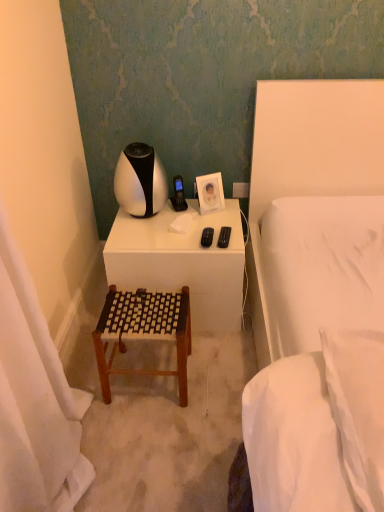
Describe the element at coordinates (182, 262) in the screenshot. I see `white matte desk at center` at that location.

Measure the distance between white fabric bed at right and camera.

The depth of white fabric bed at right is 6.02 feet.

Measure the distance between point (x=138, y=201) and camera.

Point (x=138, y=201) is 1.92 meters away from camera.

This screenshot has width=384, height=512. In order to click on white glossy table lamp at upper center in this screenshot , I will do `click(140, 181)`.

Measure the distance between white soft pillow at right and camera.

white soft pillow at right and camera are 30.63 inches apart.

The width and height of the screenshot is (384, 512). What are the coordinates of `white fabric curtain at left` in the screenshot? It's located at (35, 401).

Does brown woven stool at center appear on the left side of white matte desk at center?

Indeed, brown woven stool at center is positioned on the left side of white matte desk at center.

Does brown woven stool at center contain white matte desk at center?

Definitely not — white matte desk at center is not inside brown woven stool at center.

Considering the sizes of objects brown woven stool at center and white matte desk at center in the image provided, who is smaller, brown woven stool at center or white matte desk at center?

brown woven stool at center.

In order to click on desk that is behind the brown woven stool at center in this screenshot , I will do `click(182, 262)`.

Is white glossy table lamp at upper center aimed at white fabric curtain at left?

No, white glossy table lamp at upper center is not aimed at white fabric curtain at left.

From the image's perspective, is white glossy table lamp at upper center located above or below white fabric curtain at left?

white glossy table lamp at upper center is situated higher than white fabric curtain at left in the image.

From a real-world perspective, is white glossy table lamp at upper center physically located above or below white fabric curtain at left?

white glossy table lamp at upper center is above white fabric curtain at left.

Is white glossy table lamp at upper center completely or partially outside of white matte desk at center?

Yes, white glossy table lamp at upper center is located beyond the bounds of white matte desk at center.

Which is more distant, (155, 196) or (119, 273)?

Positioned behind is point (155, 196).

From a real-world perspective, who is located lower, white glossy table lamp at upper center or white matte desk at center?

From a 3D spatial view, white matte desk at center is below.

From the image's perspective, between white matte desk at center and brown woven stool at center, who is located below?

brown woven stool at center is shown below in the image.

Considering the relative positions of white matte desk at center and brown woven stool at center in the image provided, is white matte desk at center to the right of brown woven stool at center from the viewer's perspective?

Correct, you'll find white matte desk at center to the right of brown woven stool at center.

In terms of width, does white matte desk at center look wider or thinner when compared to brown woven stool at center?

Considering their sizes, white matte desk at center looks broader than brown woven stool at center.

Is point (222, 267) positioned behind point (170, 334)?

Yes, point (222, 267) is behind point (170, 334).

What's the angular difference between white fabric curtain at left and white soft pillow at right's facing directions?

The angular difference between white fabric curtain at left and white soft pillow at right is 1.12 degrees.

From a real-world perspective, which is physically below, white fabric curtain at left or white soft pillow at right?

white fabric curtain at left, from a real-world perspective.

From the image's perspective, between white fabric curtain at left and white soft pillow at right, who is located below?

Answer: From the image's view, white fabric curtain at left is below.

At what (x,y) coordinates should I click in order to perform the action: click on desk behind the white fabric bed at right. Please return your answer as a coordinate pair (x, y). This screenshot has height=512, width=384. Looking at the image, I should click on (182, 262).

Which of these two, white matte desk at center or white fabric bed at right, is bigger?

white fabric bed at right.

Is white matte desk at center closer to the viewer compared to white fabric bed at right?

No, it is behind white fabric bed at right.

Which object is thinner, white matte desk at center or white fabric bed at right?

Thinner between the two is white matte desk at center.

Would you say white fabric curtain at left is a long distance from white matte desk at center?

No.

Between white fabric curtain at left and white matte desk at center, which one is positioned behind?

white matte desk at center is more distant.

From a real-world perspective, does white fabric curtain at left stand above white matte desk at center?

No, from a real-world perspective, white fabric curtain at left is not on top of white matte desk at center.

Which of these two, white fabric curtain at left or white matte desk at center, is thinner?

Thinner between the two is white fabric curtain at left.

Identify the location of furniture on the left of white matte desk at center. The image size is (384, 512). (143, 331).

Identify the location of curtain that appears below the white glossy table lamp at upper center (from a real-world perspective). This screenshot has height=512, width=384. (35, 401).

Estimate the real-world distances between objects in this image. Which object is further from white glossy table lamp at upper center, white fabric bed at right or brown woven stool at center?

white fabric bed at right.

Which object lies nearer to the anchor point white fabric curtain at left, brown woven stool at center or white matte desk at center?

brown woven stool at center is closer to white fabric curtain at left.

Based on their spatial positions, is white soft pillow at right or white fabric curtain at left further from brown woven stool at center?

white soft pillow at right lies further to brown woven stool at center than the other object.

Based on their spatial positions, is white glossy table lamp at upper center or white fabric bed at right closer to white soft pillow at right?

Based on the image, white fabric bed at right appears to be nearer to white soft pillow at right.

Estimate the real-world distances between objects in this image. Which object is closer to brown woven stool at center, white soft pillow at right or white fabric bed at right?

The object closer to brown woven stool at center is white fabric bed at right.

Looking at the image, which one is located closer to brown woven stool at center, white fabric bed at right or white matte desk at center?

Among the two, white matte desk at center is located nearer to brown woven stool at center.

When comparing their distances from brown woven stool at center, does white glossy table lamp at upper center or white soft pillow at right seem further?

white soft pillow at right is further to brown woven stool at center.

From the image, which object appears to be farther from white fabric curtain at left, white soft pillow at right or white glossy table lamp at upper center?

white glossy table lamp at upper center is positioned further to the anchor white fabric curtain at left.

The width and height of the screenshot is (384, 512). Identify the location of furniture between white soft pillow at right and white glossy table lamp at upper center along the z-axis. (143, 331).

This screenshot has height=512, width=384. In order to click on desk between white fabric bed at right and white glossy table lamp at upper center in the front-back direction in this screenshot , I will do `click(182, 262)`.

What are the coordinates of `furniture between white fabric curtain at left and white soft pillow at right in the horizontal direction` in the screenshot? It's located at (143, 331).

The width and height of the screenshot is (384, 512). Identify the location of curtain between white soft pillow at right and white glossy table lamp at upper center from front to back. (35, 401).